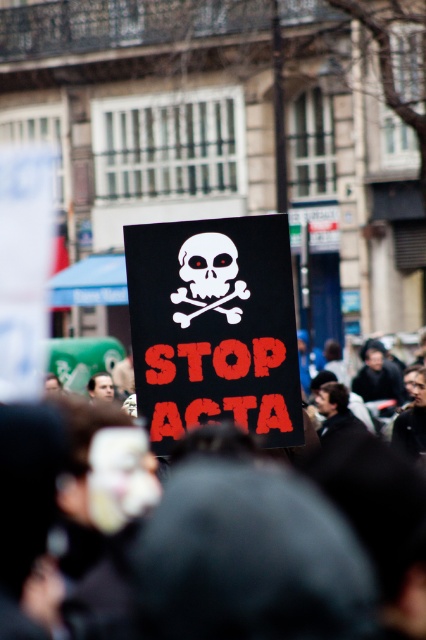
In the scene shown: Who is more distant from viewer, [29,497] or [282,362]?

The point [282,362] is behind.

Where is `black fabric crowd at center`? The width and height of the screenshot is (426, 640). black fabric crowd at center is located at coordinates (252, 573).

In order to click on black fabric crowd at center in this screenshot , I will do `click(252, 573)`.

Between point (169, 348) and point (201, 259), which one is positioned in front?

Positioned in front is point (169, 348).

Who is more distant from viewer, (181, 259) or (203, 234)?

Positioned behind is point (181, 259).

Which is in front, point (259, 404) or point (203, 273)?

Point (259, 404) is in front.

Find the location of `black matte placard at center`. black matte placard at center is located at coordinates (213, 326).

Does black fabric crowd at center have a greater height compared to white matte skull at center?

Yes, black fabric crowd at center is taller than white matte skull at center.

Between black fabric crowd at center and white matte skull at center, which one has more height?

Standing taller between the two is black fabric crowd at center.

The image size is (426, 640). What do you see at coordinates (252, 573) in the screenshot?
I see `black fabric crowd at center` at bounding box center [252, 573].

At what (x,y) coordinates should I click in order to perform the action: click on black fabric crowd at center. Please return your answer as a coordinate pair (x, y). The height and width of the screenshot is (640, 426). Looking at the image, I should click on (252, 573).